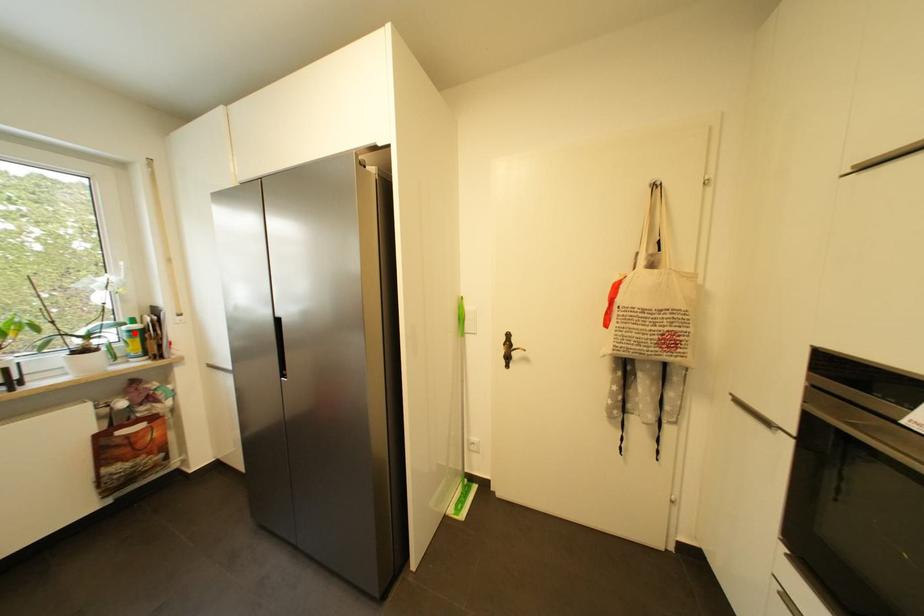
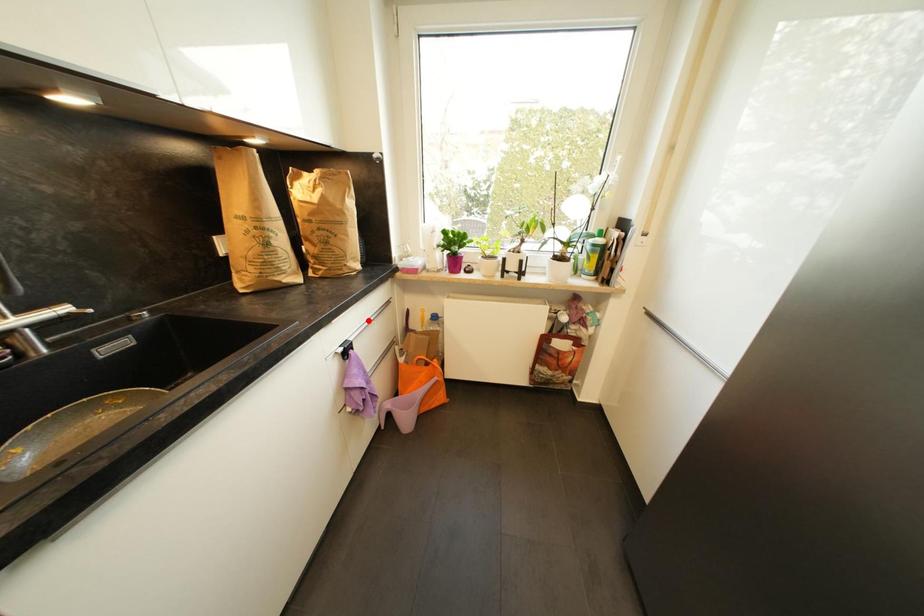
I am providing you with two images of the same scene from different viewpoints. A red point is marked on the first image and another point is marked on the second image. Is the marked point in image1 the same physical position as the marked point in image2?

No